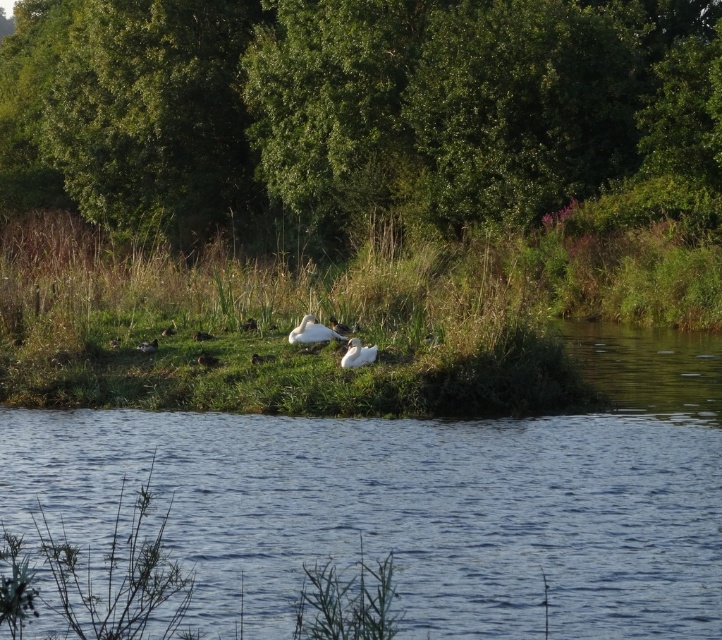
You are standing on the edge of the island and want to approach the white feathered bird at lower left without stepping on the green grass at center. Which direction should you move relative to the bird?

You should move to the left of the white feathered bird at lower left because the green grass at center is located to its right, so avoiding the grass would require moving in the opposite direction.

You are a small insect trying to cross from the white feathered bird at lower left to the green grass at center. Considering their sizes, will you have enough space to move freely between them?

The green grass at center has a larger size compared to the white feathered bird at lower left, so there might be sufficient space for the insect to move freely between them.